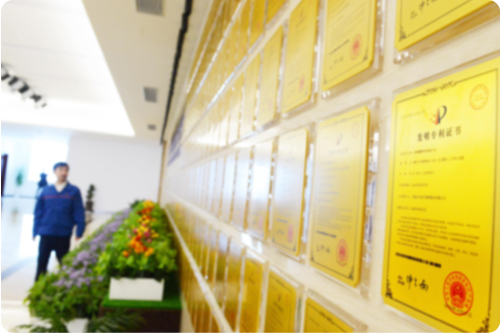
At what (x,y) coordinates should I click in order to perform the action: click on wall covered in yellow plaques. Please return your answer as a coordinate pair (x, y). This screenshot has height=333, width=500. Looking at the image, I should click on (367, 90).